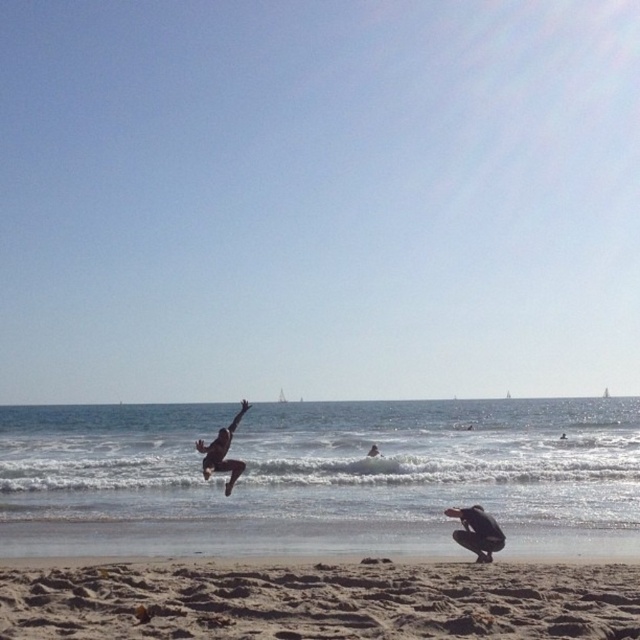
Question: Does sandy beach at lower center have a lesser width compared to silhouette figure at center?

Choices:
 (A) yes
 (B) no

Answer: (A)

Question: Is sandy beach at lower center to the right of black matte person at lower right from the viewer's perspective?

Choices:
 (A) no
 (B) yes

Answer: (A)

Question: Which point is closer to the camera?

Choices:
 (A) (243, 468)
 (B) (380, 452)
 (C) (147, 563)

Answer: (C)

Question: Estimate the real-world distances between objects in this image. Which object is closer to the smooth black figure at center?

Choices:
 (A) black matte person at lower right
 (B) sandy beach at lower center

Answer: (A)

Question: Which point appears farthest from the camera in this image?

Choices:
 (A) (632, 582)
 (B) (497, 545)

Answer: (B)

Question: Does smooth black figure at center have a larger size compared to silhouette figure at center?

Choices:
 (A) yes
 (B) no

Answer: (A)